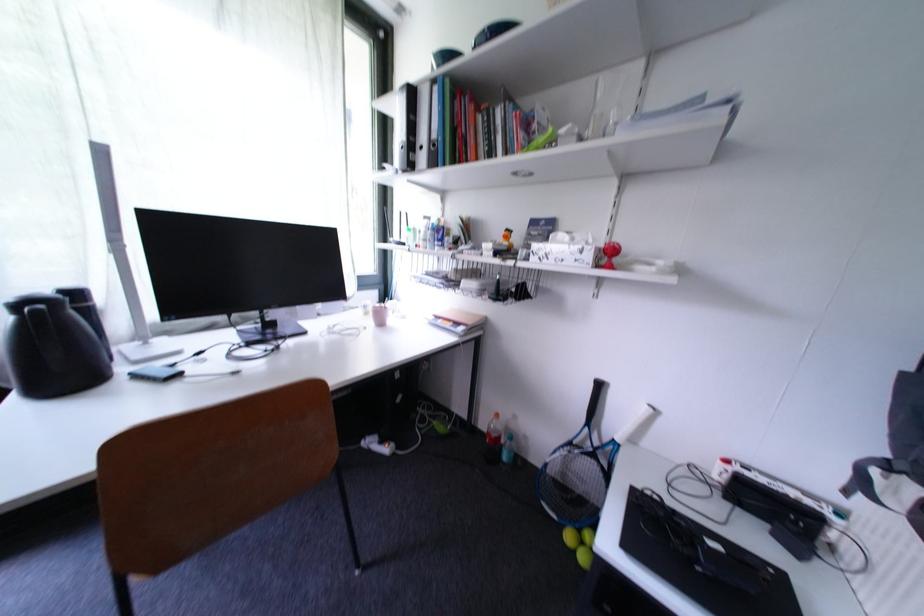
Identify the location of soda bottle. The image size is (924, 616). (492, 440).